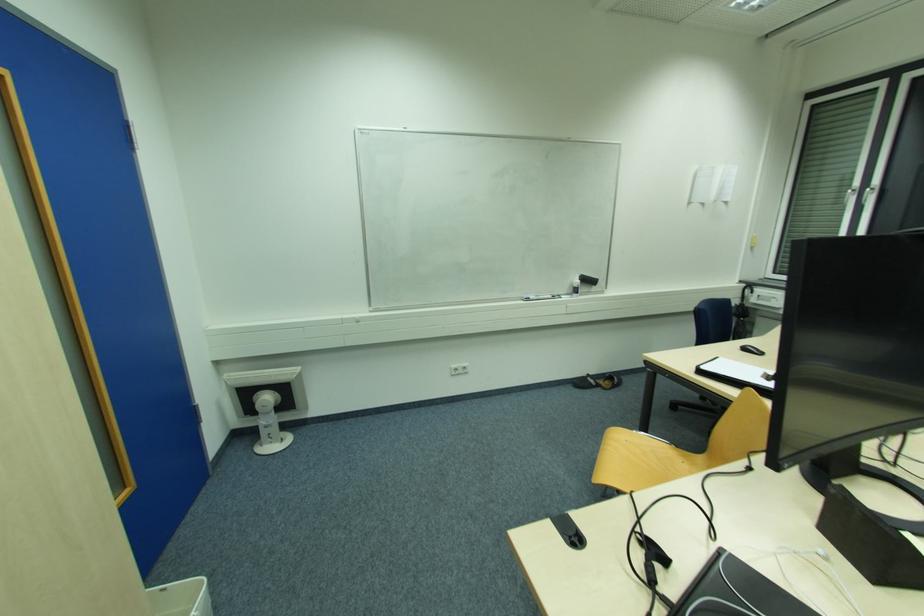
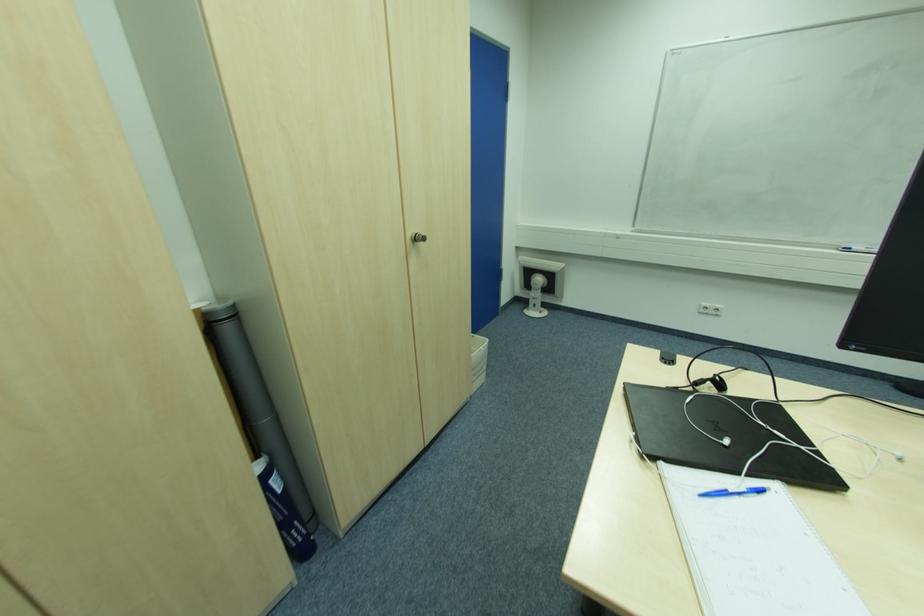
The first image is from the beginning of the video and the second image is from the end. How did the camera likely rotate when shooting the video?

The rotation direction of the camera is left-down.